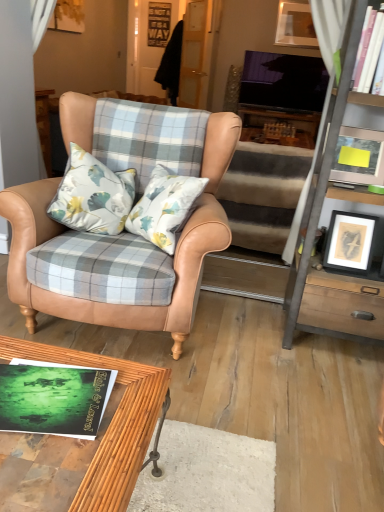
At what (x,y) coordinates should I click in order to perform the action: click on free point above bamboo wood coffee table at lower center (from a real-world perspective). Please return your answer as a coordinate pair (x, y). Looking at the image, I should click on (66, 404).